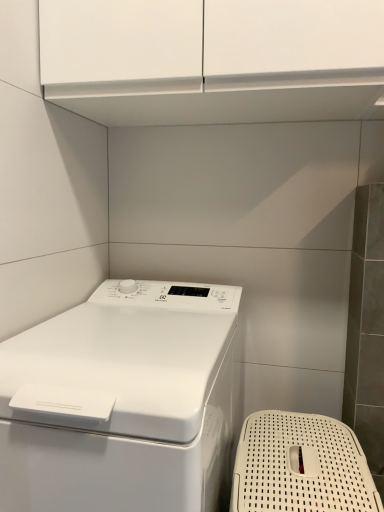
You are a GUI agent. You are given a task and a screenshot of the screen. Output one action in this format:
    pyautogui.click(x=<x>, y=<y>)
    Task: Click on the white plastic basket at lower right
    This screenshot has width=384, height=512.
    Given the screenshot: What is the action you would take?
    pyautogui.click(x=298, y=466)

Describe the element at coordinates (298, 466) in the screenshot. I see `white plastic basket at lower right` at that location.

This screenshot has width=384, height=512. Describe the element at coordinates (122, 402) in the screenshot. I see `white glossy washing machine at lower left` at that location.

This screenshot has height=512, width=384. I want to click on white glossy washing machine at lower left, so click(122, 402).

Where is `white plastic basket at lower right`? This screenshot has width=384, height=512. white plastic basket at lower right is located at coordinates (298, 466).

Between white plastic basket at lower right and white glossy washing machine at lower left, which one appears on the right side from the viewer's perspective?

white plastic basket at lower right.

Relative to white glossy washing machine at lower left, is white plastic basket at lower right in front or behind?

white plastic basket at lower right is behind white glossy washing machine at lower left.

Which is in front, point (256, 489) or point (131, 293)?

The point (256, 489) is closer.

From the image's perspective, does white plastic basket at lower right appear higher than white glossy washing machine at lower left?

No.

From a real-world perspective, who is located higher, white plastic basket at lower right or white glossy washing machine at lower left?

white glossy washing machine at lower left, from a real-world perspective.

In terms of width, does white plastic basket at lower right look wider or thinner when compared to white glossy washing machine at lower left?

Clearly, white plastic basket at lower right has less width compared to white glossy washing machine at lower left.

Considering the relative sizes of white plastic basket at lower right and white glossy washing machine at lower left in the image provided, is white plastic basket at lower right taller than white glossy washing machine at lower left?

In fact, white plastic basket at lower right may be shorter than white glossy washing machine at lower left.

In terms of size, does white plastic basket at lower right appear bigger or smaller than white glossy washing machine at lower left?

A: white plastic basket at lower right is smaller than white glossy washing machine at lower left.

Would you say white plastic basket at lower right contains white glossy washing machine at lower left?

No, white glossy washing machine at lower left is not inside white plastic basket at lower right.

Looking at this image, is white plastic basket at lower right far from white glossy washing machine at lower left?

No, white plastic basket at lower right is in close proximity to white glossy washing machine at lower left.

Is white plastic basket at lower right oriented towards white glossy washing machine at lower left?

No, white plastic basket at lower right is not facing towards white glossy washing machine at lower left.

How distant is white plastic basket at lower right from white glossy washing machine at lower left?

white plastic basket at lower right and white glossy washing machine at lower left are 9.18 inches apart from each other.

Find the location of a particular element. This screenshot has width=384, height=512. home appliance above the white plastic basket at lower right (from the image's perspective) is located at coordinates (122, 402).

Which object is positioned more to the left, white glossy washing machine at lower left or white plastic basket at lower right?

white glossy washing machine at lower left.

Which object is further away from the camera taking this photo, white glossy washing machine at lower left or white plastic basket at lower right?

white plastic basket at lower right is more distant.

Considering the positions of point (181, 483) and point (233, 509), is point (181, 483) closer or farther from the camera than point (233, 509)?

Point (181, 483).

From the image's perspective, which is below, white glossy washing machine at lower left or white plastic basket at lower right?

From the image's view, white plastic basket at lower right is below.

From a real-world perspective, is white glossy washing machine at lower left positioned over white plastic basket at lower right based on gravity?

Yes, from a real-world perspective, white glossy washing machine at lower left is above white plastic basket at lower right.

Can you confirm if white glossy washing machine at lower left is wider than white plastic basket at lower right?

Indeed, white glossy washing machine at lower left has a greater width compared to white plastic basket at lower right.

From their relative heights in the image, would you say white glossy washing machine at lower left is taller or shorter than white plastic basket at lower right?

Clearly, white glossy washing machine at lower left is taller compared to white plastic basket at lower right.

Considering the sizes of objects white glossy washing machine at lower left and white plastic basket at lower right in the image provided, who is smaller, white glossy washing machine at lower left or white plastic basket at lower right?

With smaller size is white plastic basket at lower right.

Is white plastic basket at lower right completely or partially inside white glossy washing machine at lower left?

No, white plastic basket at lower right is not inside white glossy washing machine at lower left.

Is white glossy washing machine at lower left not near white plastic basket at lower right?

white glossy washing machine at lower left is actually quite close to white plastic basket at lower right.

Could you tell me if white glossy washing machine at lower left is facing white plastic basket at lower right?

No, white glossy washing machine at lower left does not turn towards white plastic basket at lower right.

How many degrees apart are the facing directions of white glossy washing machine at lower left and white plastic basket at lower right?

The facing directions of white glossy washing machine at lower left and white plastic basket at lower right are 0.101 degrees apart.

How much distance is there between white glossy washing machine at lower left and white plastic basket at lower right?

A distance of 9.18 inches exists between white glossy washing machine at lower left and white plastic basket at lower right.

I want to click on home appliance in front of the white plastic basket at lower right, so click(x=122, y=402).

The width and height of the screenshot is (384, 512). In order to click on home appliance above the white plastic basket at lower right (from the image's perspective) in this screenshot , I will do `click(122, 402)`.

You are a GUI agent. You are given a task and a screenshot of the screen. Output one action in this format:
    pyautogui.click(x=<x>, y=<y>)
    Task: Click on the home appliance in front of the white plastic basket at lower right
    The image size is (384, 512).
    Given the screenshot: What is the action you would take?
    pyautogui.click(x=122, y=402)